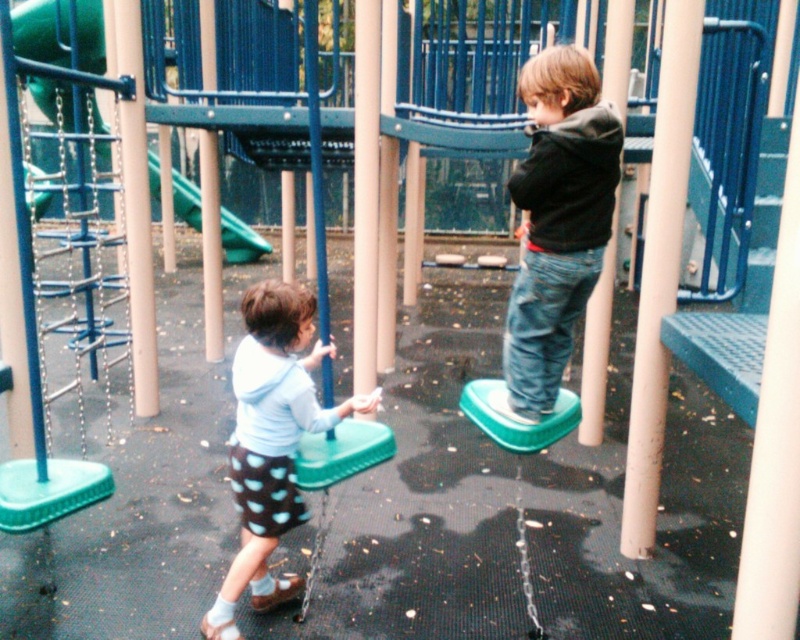
You are standing at the entrance of the playground and want to locate the green plastic swing at center. According to the coordinates provided, where should you look to find it?

The green plastic swing at center is located at coordinates point (341,452).

In the scene shown: You are a parent trying to locate your child in the playground. You remember your child is wearing a dark gray hoodie at center and another child is wearing a white matte shirt at center. Based on the scene description, which child is on the right side when looking at the two children from the parent perspective?

The dark gray hoodie at center is positioned on the right side of white matte shirt at center, so the child wearing the dark gray hoodie at center is on the right side.

You are a parent supervising kids at the playground. You notice the green plastic swing at center and the green rubber slide at upper left. Which object is taller?

The green plastic swing at center is much taller than the green rubber slide at upper left.